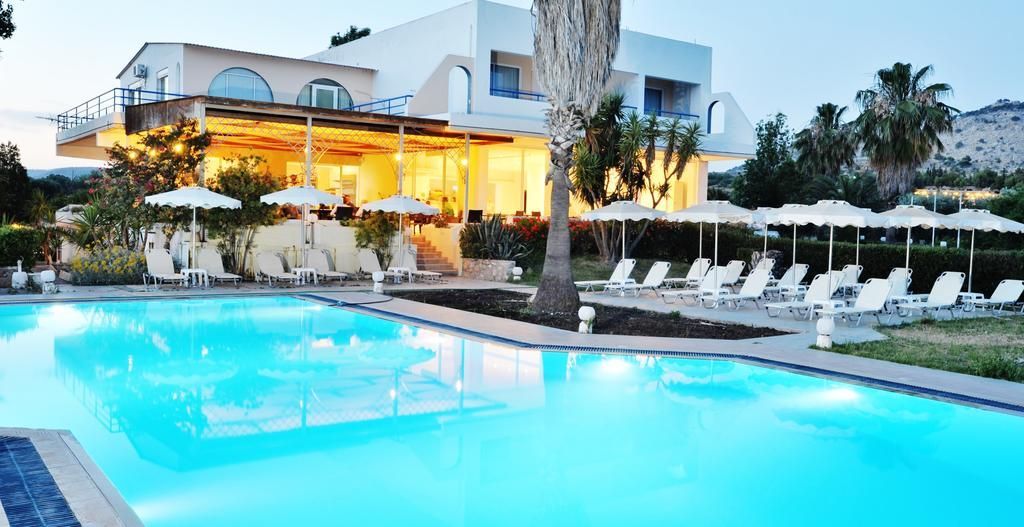
You are a GUI agent. You are given a task and a screenshot of the screen. Output one action in this format:
    pyautogui.click(x=<x>, y=<y>)
    Task: Click on the window
    
    Given the screenshot: What is the action you would take?
    pyautogui.click(x=231, y=84), pyautogui.click(x=313, y=93), pyautogui.click(x=503, y=73), pyautogui.click(x=655, y=95), pyautogui.click(x=162, y=84), pyautogui.click(x=133, y=93)